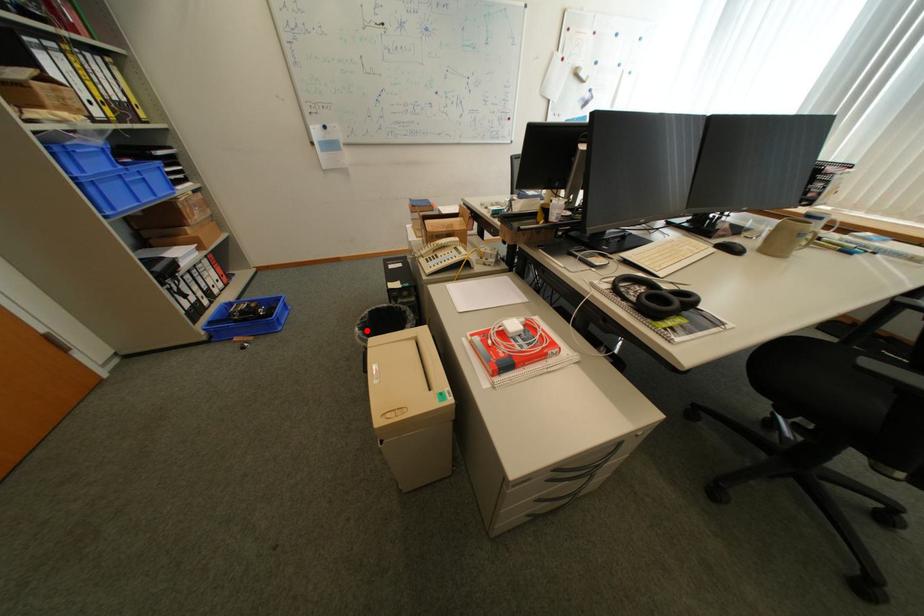
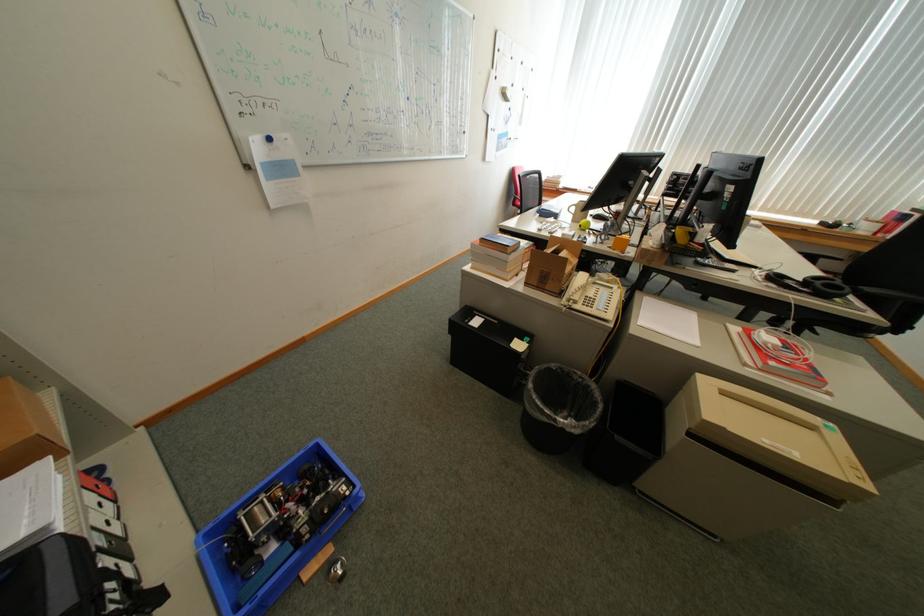
Where in the second image is the point corresponding to the highlighted location from the first image?

(572, 421)